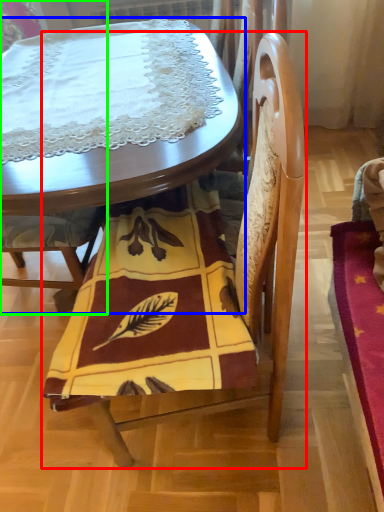
Question: Which object is positioned farthest from chair (highlighted by a red box)? Select from table (highlighted by a blue box) and chair (highlighted by a green box).

Choices:
 (A) table
 (B) chair

Answer: (B)